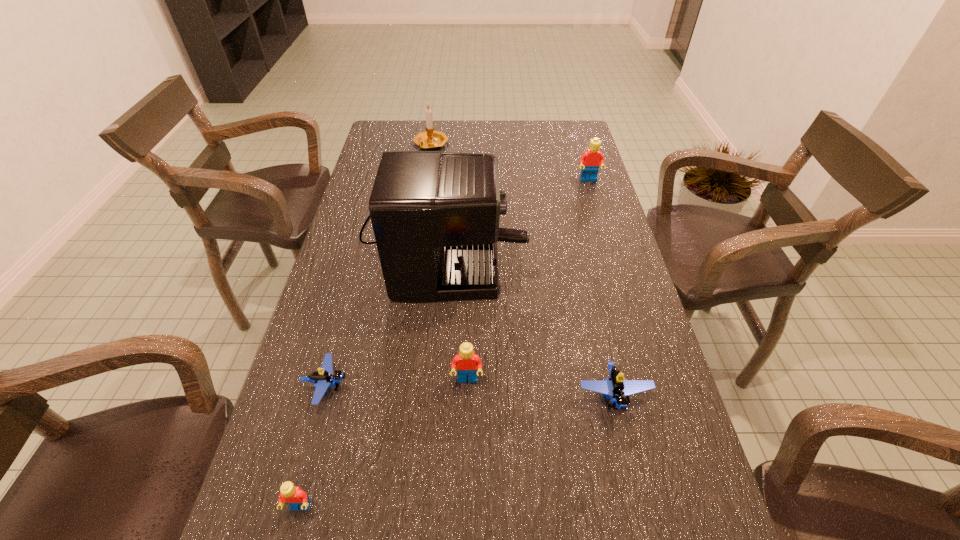
Find the location of a particular element. The width and height of the screenshot is (960, 540). unoccupied area between the second farthest red Lego and the coffee maker is located at coordinates (454, 306).

Where is `free point between the candle holder and the shortest object`? This screenshot has height=540, width=960. free point between the candle holder and the shortest object is located at coordinates (379, 266).

Identify the location of free area in between the right blue Lego and the smallest red Lego. (457, 452).

Select which object appears as the closest to the fourth shortest Lego. Please provide its 2D coordinates. Your answer should be formatted as a tuple, i.e. [(x, y)], where the tuple contains the x and y coordinates of a point satisfying the conditions above.

[(435, 215)]

What are the coordinates of `the fifth closest object to the bigger blue Lego` in the screenshot? It's located at (590, 161).

At what (x,y) coordinates should I click in order to perform the action: click on Lego identified as the closest to the tallest object. Please return your answer as a coordinate pair (x, y). The height and width of the screenshot is (540, 960). Looking at the image, I should click on [324, 378].

Where is `the fourth closest Lego to the smaller blue Lego`? This screenshot has width=960, height=540. the fourth closest Lego to the smaller blue Lego is located at coordinates (590, 161).

Choose which red Lego is the nearest neighbor to the coffee maker. Please provide its 2D coordinates. Your answer should be formatted as a tuple, i.e. [(x, y)], where the tuple contains the x and y coordinates of a point satisfying the conditions above.

[(467, 362)]

Locate an element on the screen. the second closest red Lego to the bigger blue Lego is located at coordinates (295, 497).

Locate an element on the screen. The image size is (960, 540). the closest blue Lego relative to the tallest object is located at coordinates (324, 378).